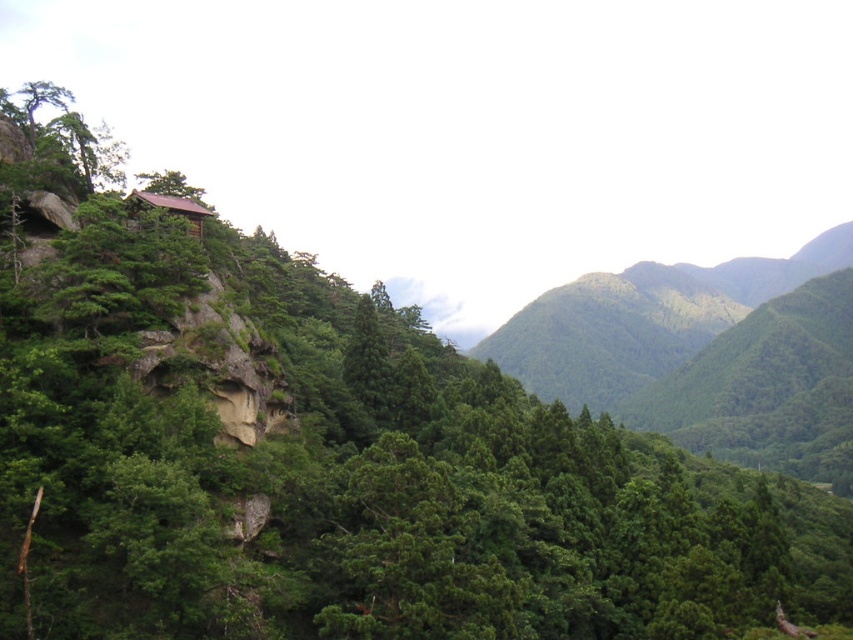
Who is shorter, green leafy forest at center or brown wooden hut at upper left?

With less height is brown wooden hut at upper left.

Does point (822, 268) come behind point (148, 196)?

Yes, it is behind point (148, 196).

Measure the distance between point (x=732, y=442) and camera.

A distance of 420.36 meters exists between point (x=732, y=442) and camera.

Locate an element on the screen. green leafy forest at center is located at coordinates (705, 353).